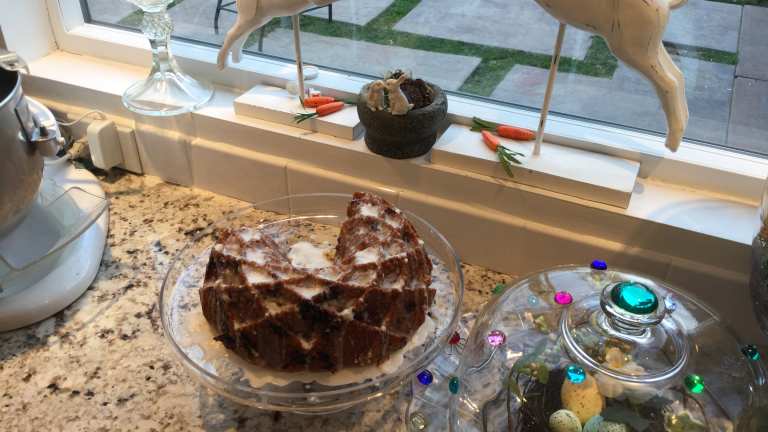
The image size is (768, 432). I want to click on counter top, so click(x=143, y=376).